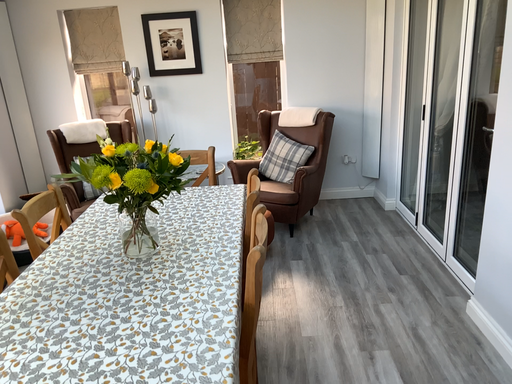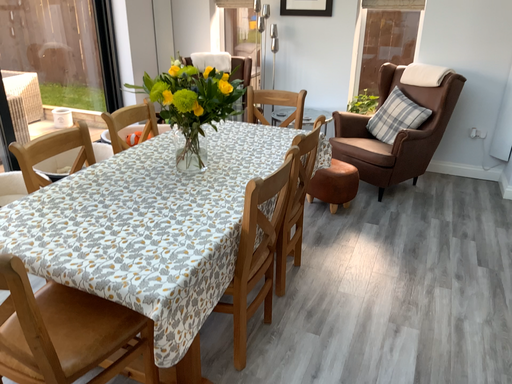
Question: How did the camera likely rotate when shooting the video?

Choices:
 (A) rotated right
 (B) rotated left

Answer: (B)